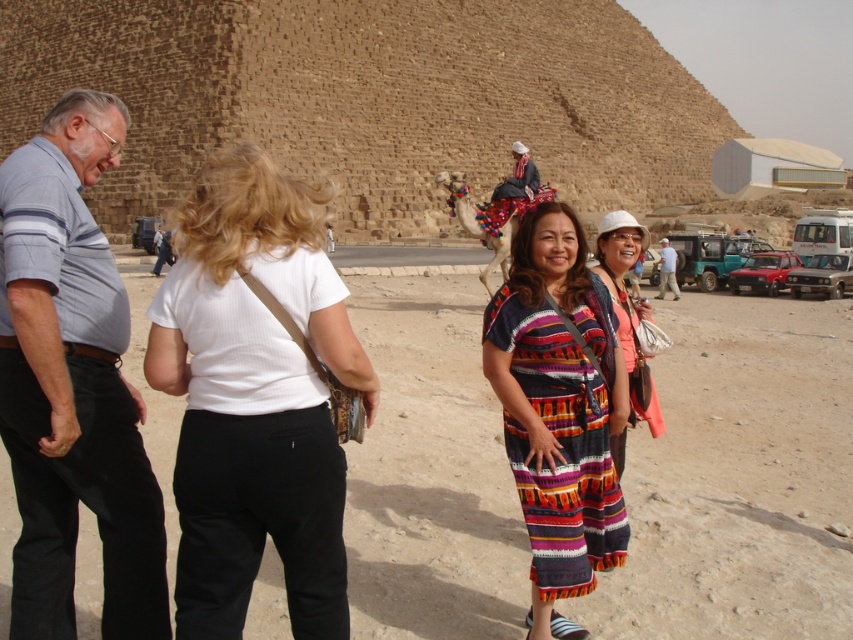
You are an archaeologist examining the clothing of two individuals in the scene. The first person wears a white cotton shirt at center and the second wears a light blue denim shirt at center. Based on the description provided, which shirt has a greater width?

The white cotton shirt at center has a greater width than the light blue denim shirt at center according to the description provided.

You are standing at the base of the Great Pyramid of Giza and see two points marked on the pyramid. The first point is at coordinates point (128, 554) and the second point is at point (674, 285). Which point is closer to your current position?

The point at coordinates point (128, 554) is closer to your current position because it is closer to the camera than point (674, 285).